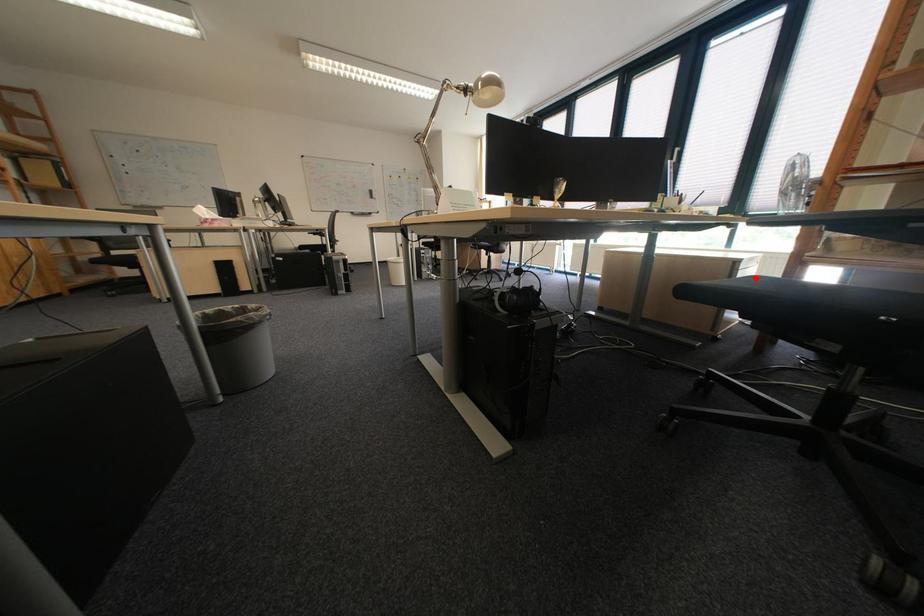
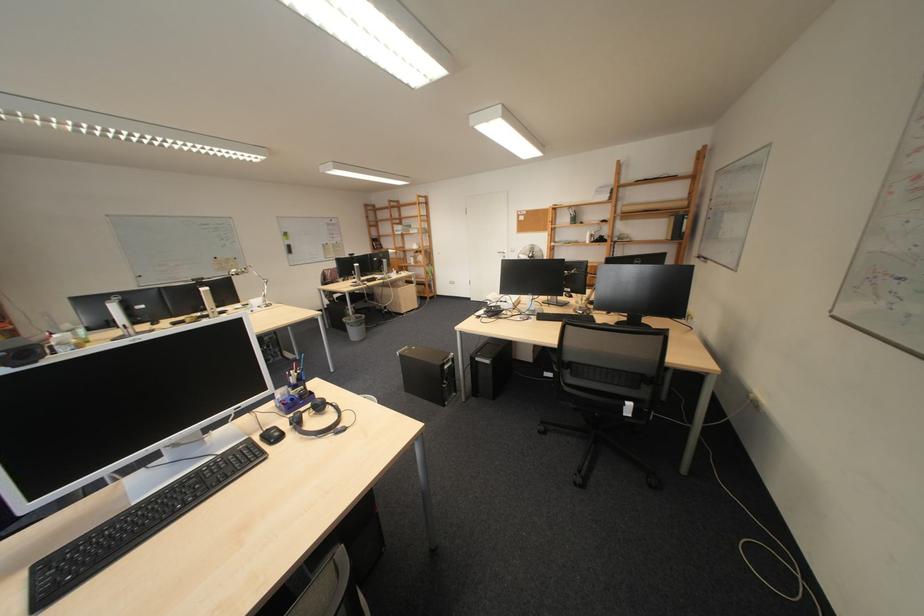
Question: I am providing you with two images of the same scene from different viewpoints. A red point is marked on the first image. At the location where the point appears in image 1, is it still visible in image 2?

Choices:
 (A) Yes
 (B) No

Answer: (B)